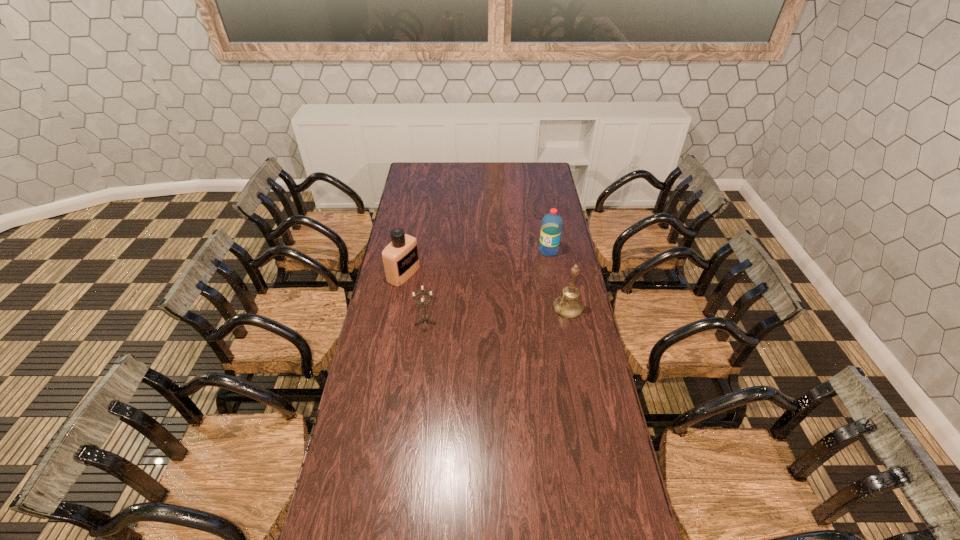
You are a GUI agent. You are given a task and a screenshot of the screen. Output one action in this format:
    pyautogui.click(x=<x>, y=<y>)
    Task: Click on the candle holder
    Image resolution: width=960 pixels, height=540 pixels.
    Given the screenshot: What is the action you would take?
    pyautogui.click(x=425, y=317)

The width and height of the screenshot is (960, 540). Identify the location of the shortest object. (425, 317).

Where is `bell`? The width and height of the screenshot is (960, 540). bell is located at coordinates (568, 305).

Locate an element on the screen. water bottle is located at coordinates click(551, 227).

You are a GUI agent. You are given a task and a screenshot of the screen. Output one action in this format:
    pyautogui.click(x=<x>, y=<y>)
    Task: Click on the leftmost object
    This screenshot has width=960, height=540.
    Given the screenshot: What is the action you would take?
    pyautogui.click(x=400, y=258)

You are a GUI agent. You are given a task and a screenshot of the screen. Output one action in this format:
    pyautogui.click(x=<x>, y=<y>)
    Task: Click on the perfume
    
    Given the screenshot: What is the action you would take?
    pyautogui.click(x=400, y=258)

Where is `vacant space located 0.400m on the right of the third object from right to left`? Image resolution: width=960 pixels, height=540 pixels. vacant space located 0.400m on the right of the third object from right to left is located at coordinates (532, 321).

Where is `free spot located on the back of the bell`? The height and width of the screenshot is (540, 960). free spot located on the back of the bell is located at coordinates (558, 254).

Where is `vacant space located on the front label of the farthest object`? vacant space located on the front label of the farthest object is located at coordinates (511, 288).

At what (x,y) coordinates should I click in order to perform the action: click on vacant space situated 0.060m on the front label of the farthest object. Please return your answer as a coordinate pair (x, y). The image size is (960, 540). Looking at the image, I should click on pos(537,262).